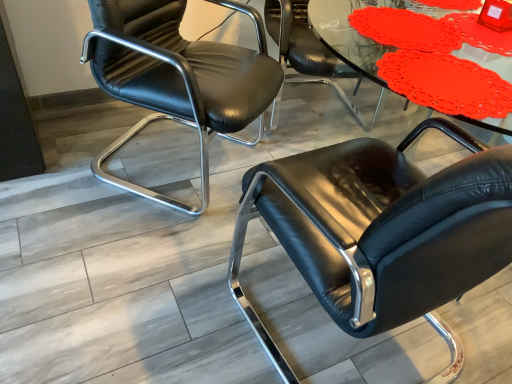
The width and height of the screenshot is (512, 384). I want to click on free space in front of black leather chair at left, marked as the 3th chair in a right-to-left arrangement, so click(131, 265).